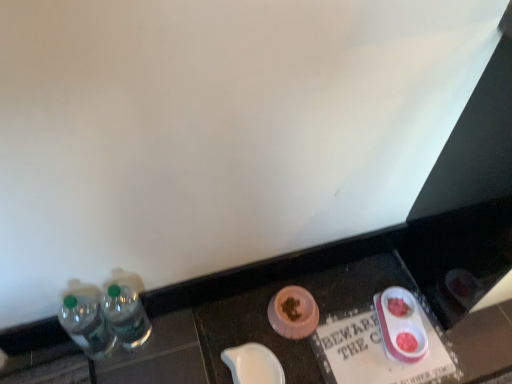
Find the location of a particular element. The image size is (512, 384). vacant space situated above white glossy bowl at lower center, the 2th tableware positioned from the right (from a real-world perspective) is located at coordinates (261, 360).